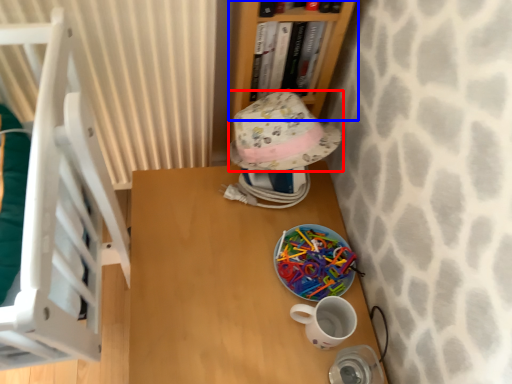
Question: Which object appears farthest to the camera in this image, hat (highlighted by a red box) or bookcase (highlighted by a blue box)?

Choices:
 (A) hat
 (B) bookcase

Answer: (A)